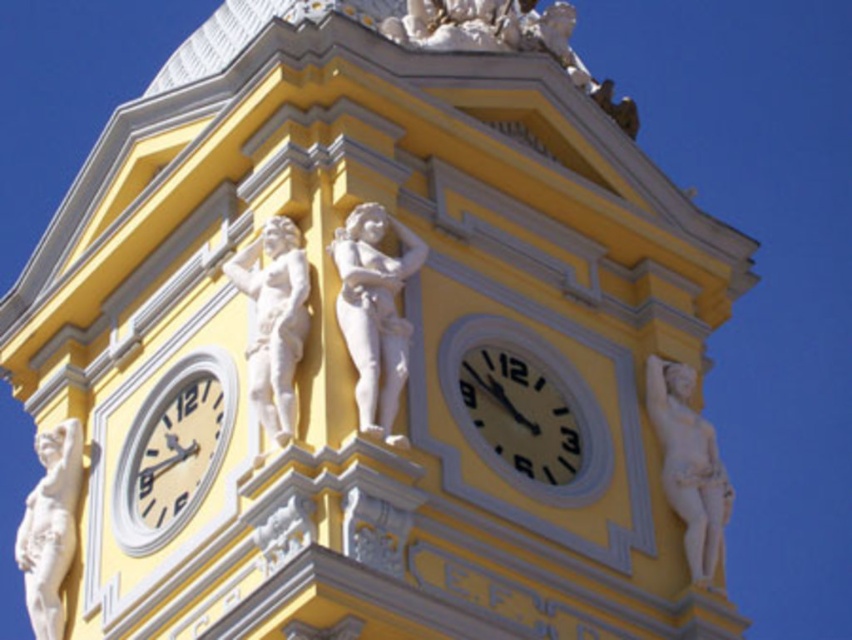
Looking at this image, you are standing in front of the clock tower and want to take a photo of the matte yellow clock at center and the white marble statue at lower left. Which object will appear larger in your photo?

The matte yellow clock at center will appear larger in your photo because it is closer to the viewer than the white marble statue at lower left.

You are standing at the base of the clock tower and want to locate the matte cream clock at lower left. According to the coordinates provided, where should you look relative to the center of the clock tower?

The matte cream clock at lower left is located at coordinates point 0.706 on the x axis and 0.204 on the y axis, so you should look to the right and slightly downward from the center of the clock tower.

You are standing in front of the clock tower and want to determine which of the two points, the point at coordinate point (x=206, y=376) or the point at coordinate point (x=417, y=236), is closer to you. Which one is closer?

The point at coordinate point (x=206, y=376) is closer to you because it is further to the viewer than the point at coordinate point (x=417, y=236).